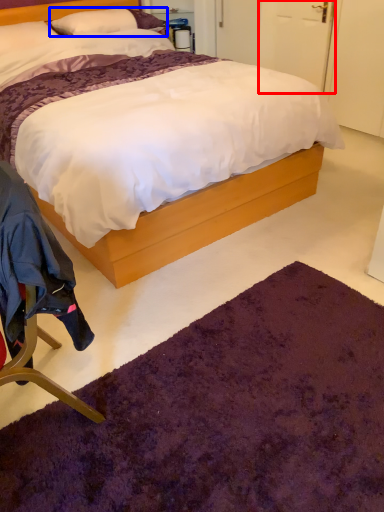
Question: Which point is further to the camera, door (highlighted by a red box) or pillow (highlighted by a blue box)?

Choices:
 (A) door
 (B) pillow

Answer: (A)